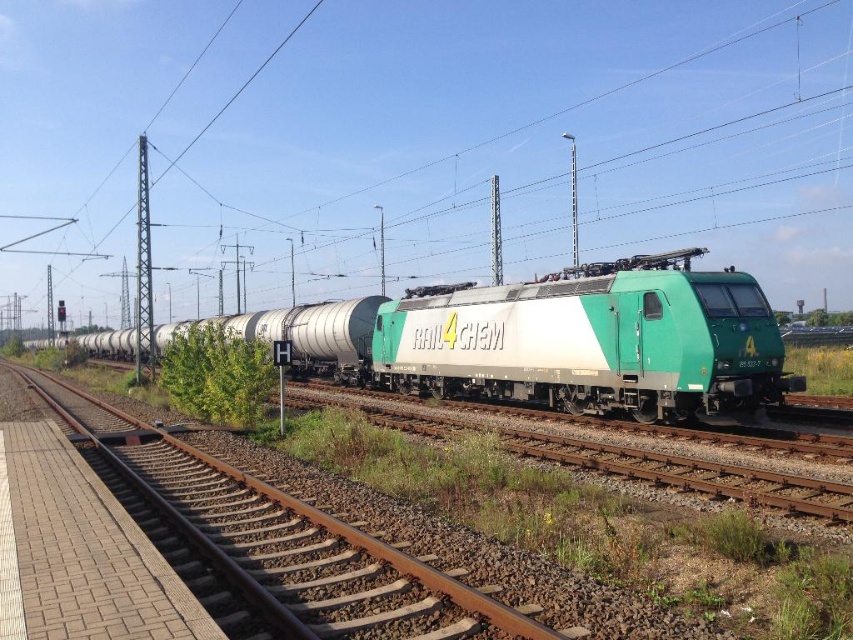
Can you confirm if green matte train at center is positioned below green metallic train track at center?

No, green matte train at center is not below green metallic train track at center.

Between point (747, 284) and point (183, 544), which one is positioned behind?

The point (747, 284) is behind.

Locate an element on the screen. Image resolution: width=853 pixels, height=640 pixels. green matte train at center is located at coordinates click(x=550, y=340).

Identify the location of green matte train at center. This screenshot has height=640, width=853. (550, 340).